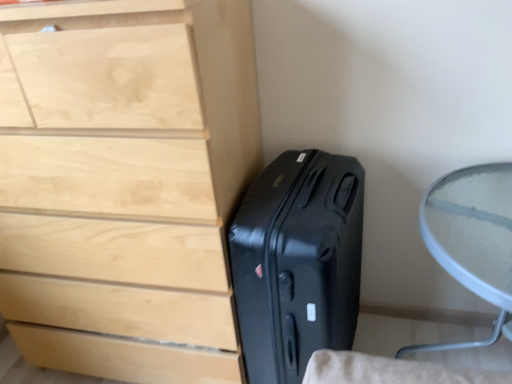
Question: Does light wood chest of drawers at left have a lesser width compared to transparent glass table at right?

Choices:
 (A) yes
 (B) no

Answer: (A)

Question: Is light wood chest of drawers at left taller than transparent glass table at right?

Choices:
 (A) yes
 (B) no

Answer: (A)

Question: Does light wood chest of drawers at left contain transparent glass table at right?

Choices:
 (A) yes
 (B) no

Answer: (B)

Question: Could you tell me if light wood chest of drawers at left is turned towards transparent glass table at right?

Choices:
 (A) no
 (B) yes

Answer: (A)

Question: Considering the relative positions of light wood chest of drawers at left and transparent glass table at right in the image provided, is light wood chest of drawers at left to the right of transparent glass table at right from the viewer's perspective?

Choices:
 (A) no
 (B) yes

Answer: (A)

Question: From the image's perspective, is transparent glass table at right above or below light wood chest of drawers at left?

Choices:
 (A) above
 (B) below

Answer: (B)

Question: Relative to light wood chest of drawers at left, is transparent glass table at right in front or behind?

Choices:
 (A) behind
 (B) front

Answer: (B)

Question: From a real-world perspective, is transparent glass table at right above or below light wood chest of drawers at left?

Choices:
 (A) below
 (B) above

Answer: (A)

Question: Considering the positions of transparent glass table at right and light wood chest of drawers at left in the image, is transparent glass table at right wider or thinner than light wood chest of drawers at left?

Choices:
 (A) wide
 (B) thin

Answer: (A)

Question: From the image's perspective, is black hardshell suitcase at lower right located above or below light wood chest of drawers at left?

Choices:
 (A) above
 (B) below

Answer: (B)

Question: Considering the positions of point (238, 312) and point (4, 306), is point (238, 312) closer or farther from the camera than point (4, 306)?

Choices:
 (A) farther
 (B) closer

Answer: (B)

Question: Is black hardshell suitcase at lower right taller or shorter than light wood chest of drawers at left?

Choices:
 (A) short
 (B) tall

Answer: (A)

Question: Looking at their shapes, would you say black hardshell suitcase at lower right is wider or thinner than light wood chest of drawers at left?

Choices:
 (A) thin
 (B) wide

Answer: (B)

Question: Does point (80, 231) appear closer or farther from the camera than point (489, 291)?

Choices:
 (A) closer
 (B) farther

Answer: (B)

Question: From a real-world perspective, relative to transparent glass table at right, is light wood chest of drawers at left vertically above or below?

Choices:
 (A) below
 (B) above

Answer: (B)